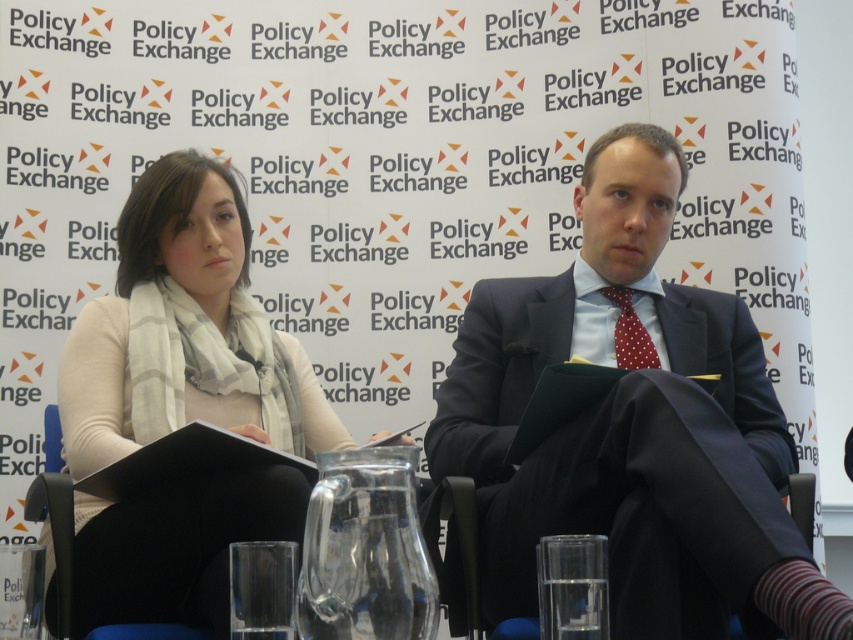
Question: Which of the following is the farthest from the observer?

Choices:
 (A) (171, 620)
 (B) (640, 364)

Answer: (B)

Question: Which point is farther to the camera?

Choices:
 (A) (508, 374)
 (B) (498, 636)
 (C) (192, 243)

Answer: (C)

Question: Is matte black suit at center below white wool scarf at center?

Choices:
 (A) no
 (B) yes

Answer: (B)

Question: Which is nearer to the polka dot silk tie at center?

Choices:
 (A) black fabric chair at center
 (B) matte black suit at center
 (C) white wool scarf at center

Answer: (B)

Question: Can you confirm if black fabric chair at center is smaller than polka dot silk tie at center?

Choices:
 (A) yes
 (B) no

Answer: (B)

Question: Considering the relative positions of matte black suit at center and polka dot silk tie at center in the image provided, where is matte black suit at center located with respect to polka dot silk tie at center?

Choices:
 (A) below
 (B) above

Answer: (A)